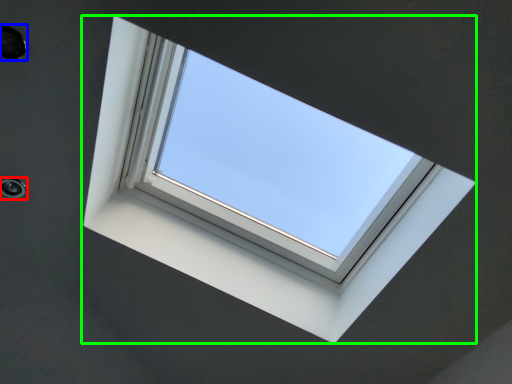
Question: Considering the real-world distances, which object is closest to hole (highlighted by a red box)? hole (highlighted by a blue box) or window (highlighted by a green box).

Choices:
 (A) hole
 (B) window

Answer: (A)